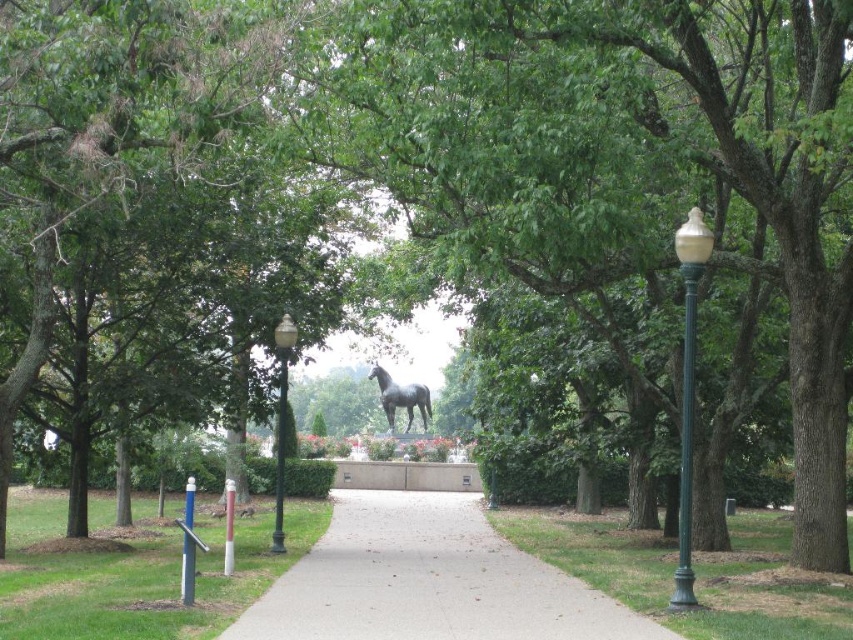
Question: Based on their relative distances, which object is farther from the green matte lamp post at center?

Choices:
 (A) blue metallic pole at lower left
 (B) white glossy lamp post at right

Answer: (B)

Question: Is gray concrete pavement at center wider than white glossy lamp post at right?

Choices:
 (A) yes
 (B) no

Answer: (A)

Question: Is shiny black statue at center to the left of blue metallic pole at lower left from the viewer's perspective?

Choices:
 (A) no
 (B) yes

Answer: (A)

Question: Does white glossy lamp post at right have a smaller size compared to shiny black statue at center?

Choices:
 (A) yes
 (B) no

Answer: (A)

Question: Which object appears farthest from the camera in this image?

Choices:
 (A) gray concrete pavement at center
 (B) green matte lamp post at center

Answer: (B)

Question: Which object is positioned closest to the green matte lamp post at center?

Choices:
 (A) shiny black statue at center
 (B) white glossy lamp post at right
 (C) blue metallic pole at lower left
 (D) gray concrete pavement at center

Answer: (D)